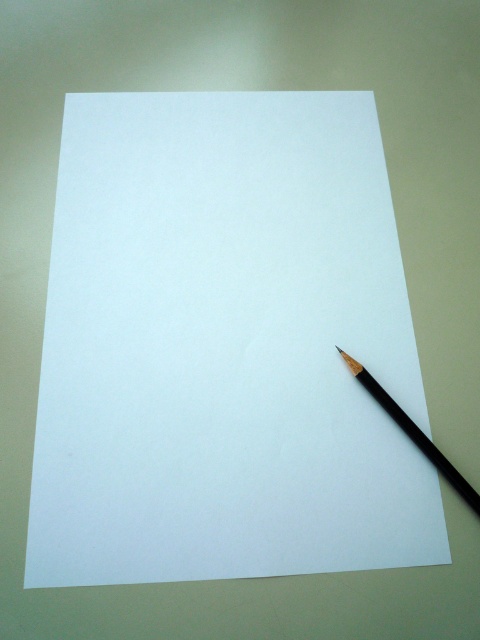
Can you confirm if white paper at center is positioned to the left of black matte pencil at lower right?

Indeed, white paper at center is positioned on the left side of black matte pencil at lower right.

Between white paper at center and black matte pencil at lower right, which one has more height?

With more height is white paper at center.

At what (x,y) coordinates should I click in order to perform the action: click on white paper at center. Please return your answer as a coordinate pair (x, y). The height and width of the screenshot is (640, 480). Looking at the image, I should click on (225, 346).

Where is `white paper at center`? Image resolution: width=480 pixels, height=640 pixels. white paper at center is located at coordinates (225, 346).